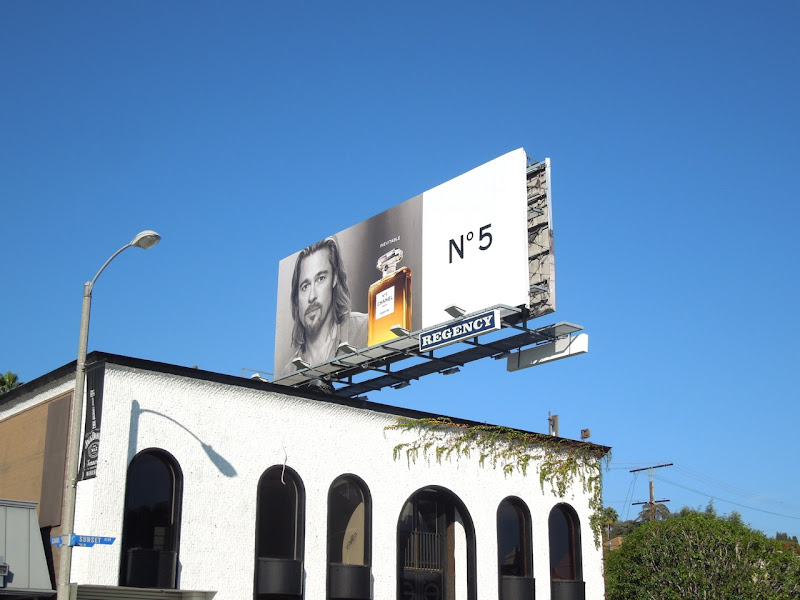
You are a GUI agent. You are given a task and a screenshot of the screen. Output one action in this format:
    pyautogui.click(x=<x>, y=<y>)
    Task: Click on the door arch
    This screenshot has width=800, height=600.
    Given the screenshot: What is the action you would take?
    pyautogui.click(x=417, y=559)